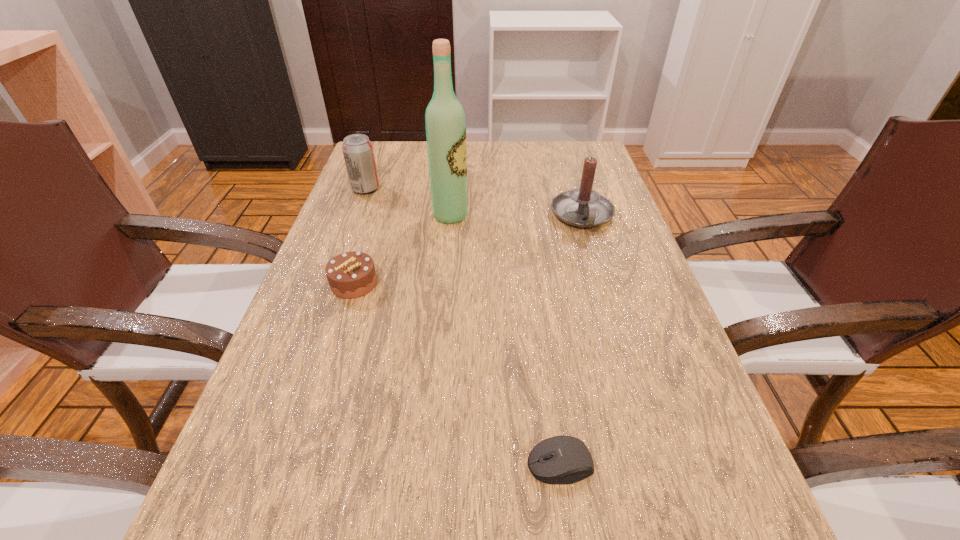
Identify the location of blank area located on the front of the soda can. (328, 288).

Where is `free spot located 0.340m on the right of the second nearest object`? The width and height of the screenshot is (960, 540). free spot located 0.340m on the right of the second nearest object is located at coordinates (539, 283).

I want to click on vacant space located 0.070m on the back of the fourth object from left to right, so click(552, 403).

You are a GUI agent. You are given a task and a screenshot of the screen. Output one action in this format:
    pyautogui.click(x=<x>, y=<y>)
    Task: Click on the soda can positioned at the left edge
    
    Given the screenshot: What is the action you would take?
    pyautogui.click(x=358, y=151)

Find the location of `chocolate cake located in the left edge section of the desktop`. chocolate cake located in the left edge section of the desktop is located at coordinates (352, 274).

Find the location of a particular element. This screenshot has height=540, width=960. object positioned at the right edge is located at coordinates (583, 207).

I want to click on vacant space at the far edge of the desktop, so click(x=496, y=178).

This screenshot has height=540, width=960. Identify the location of vacant space at the left edge. coord(299,326).

The height and width of the screenshot is (540, 960). What are the coordinates of `vacant space at the right edge of the desktop` in the screenshot? It's located at (656, 374).

In the image, there is a desktop. Identify the location of free space at the far left corner. Image resolution: width=960 pixels, height=540 pixels. (398, 148).